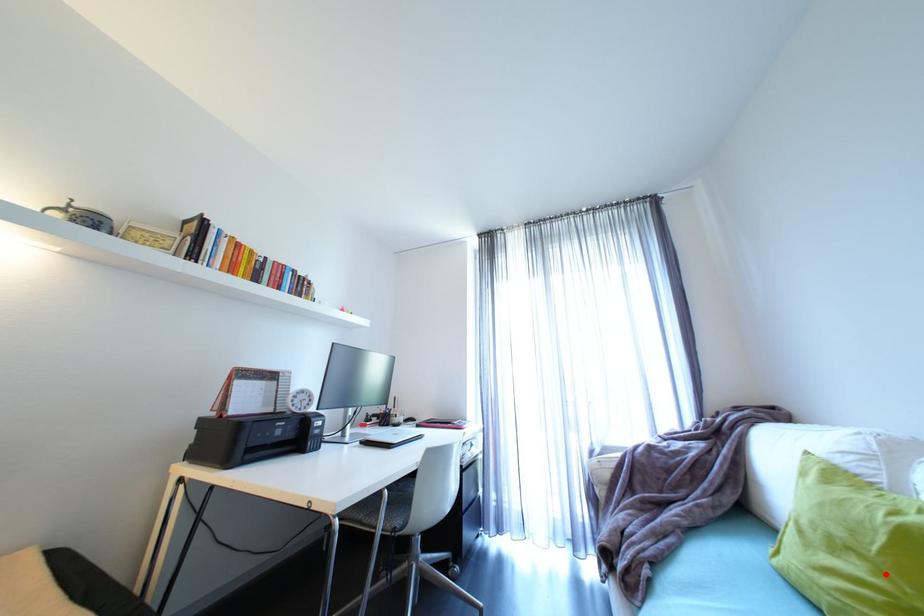
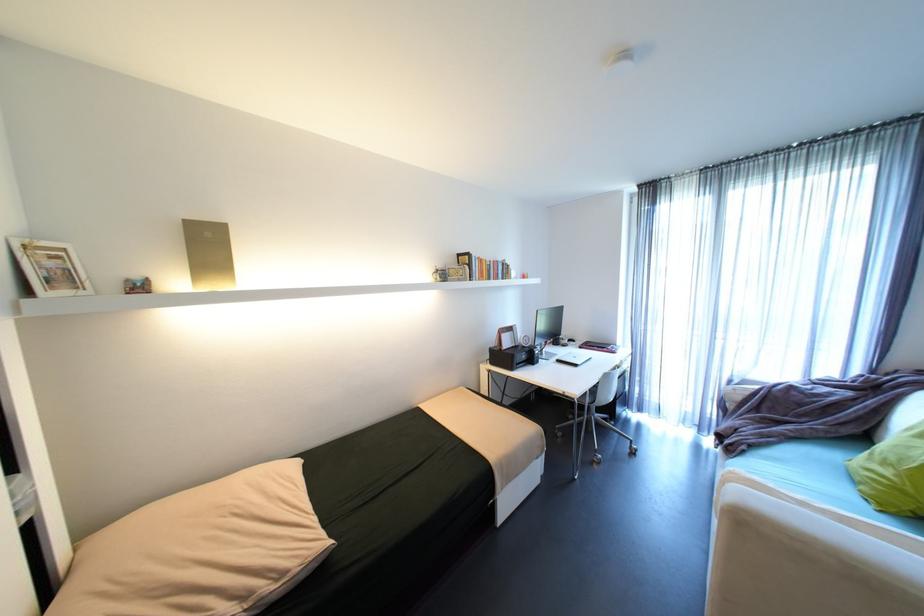
In the second image, find the point that corresponds to the highlighted location in the first image.

(906, 476)